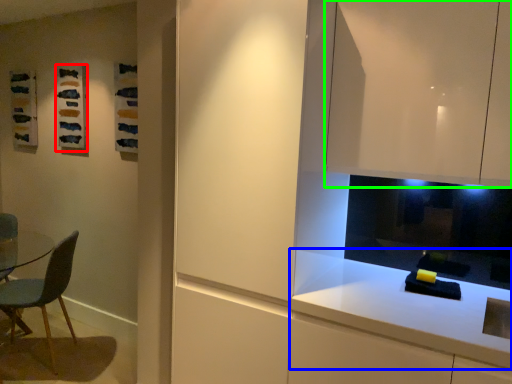
Question: Which object is positioned farthest from art (highlighted by a red box)? Select from countertop (highlighted by a blue box) and cabinetry (highlighted by a green box).

Choices:
 (A) countertop
 (B) cabinetry

Answer: (A)